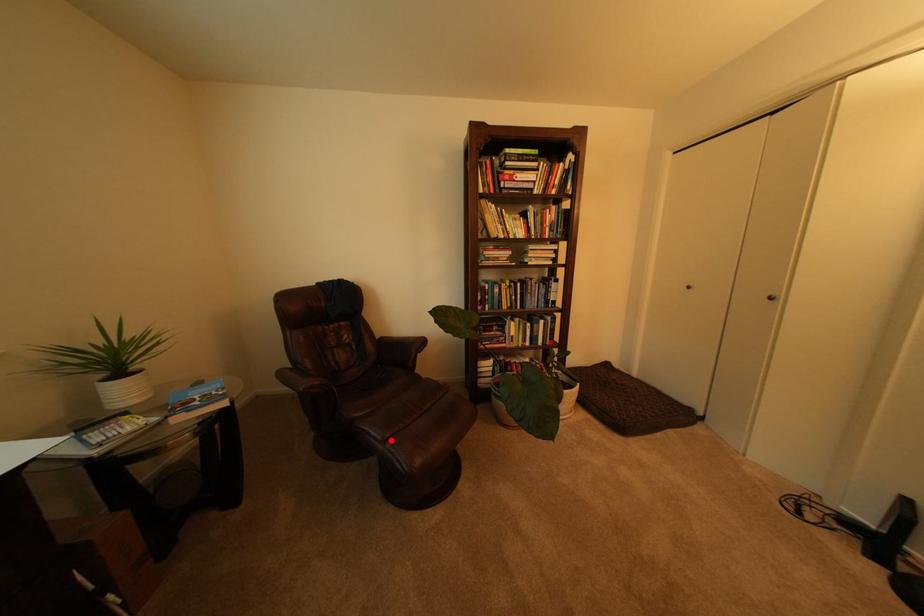
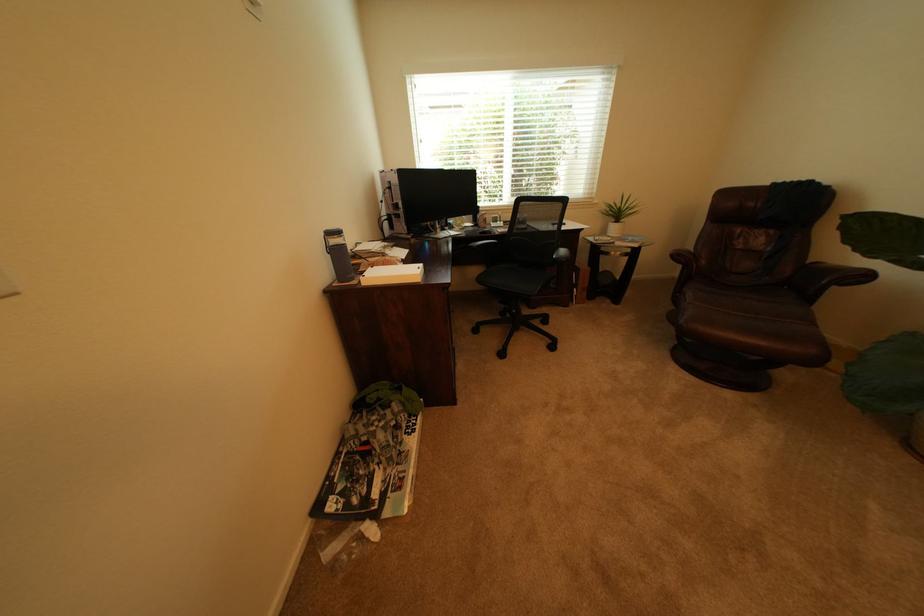
Question: I am providing you with two images of the same scene from different viewpoints. Given a red point in image1, look at the same physical point in image2. Is it:

Choices:
 (A) Closer to the viewpoint
 (B) Farther from the viewpoint

Answer: (A)